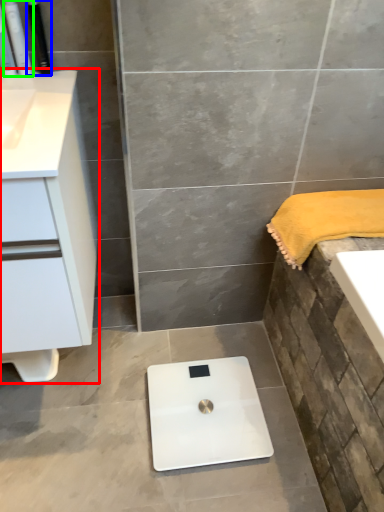
Question: Which is nearer to the bathroom cabinet (highlighted by a red box)? toiletry (highlighted by a blue box) or toiletry (highlighted by a green box).

Choices:
 (A) toiletry
 (B) toiletry

Answer: (A)